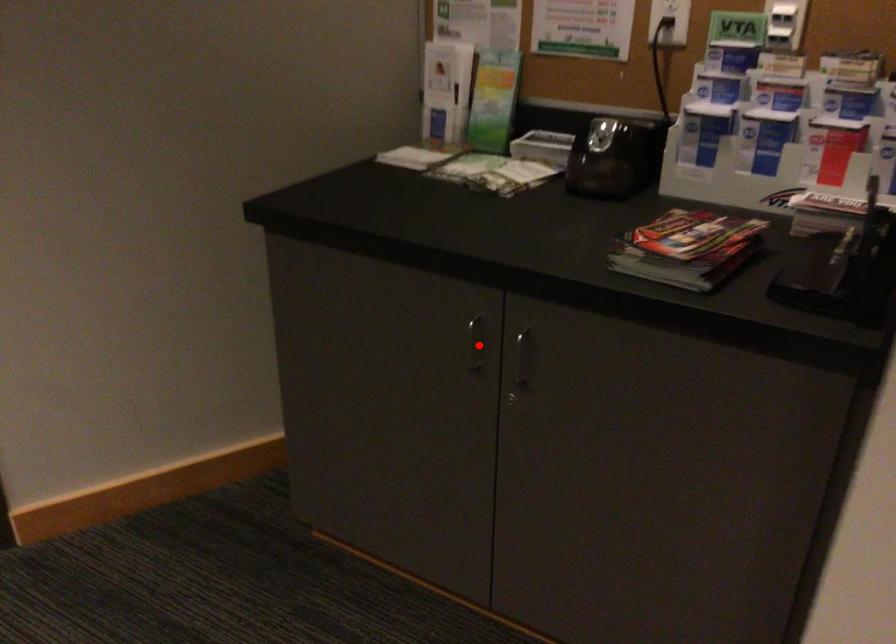
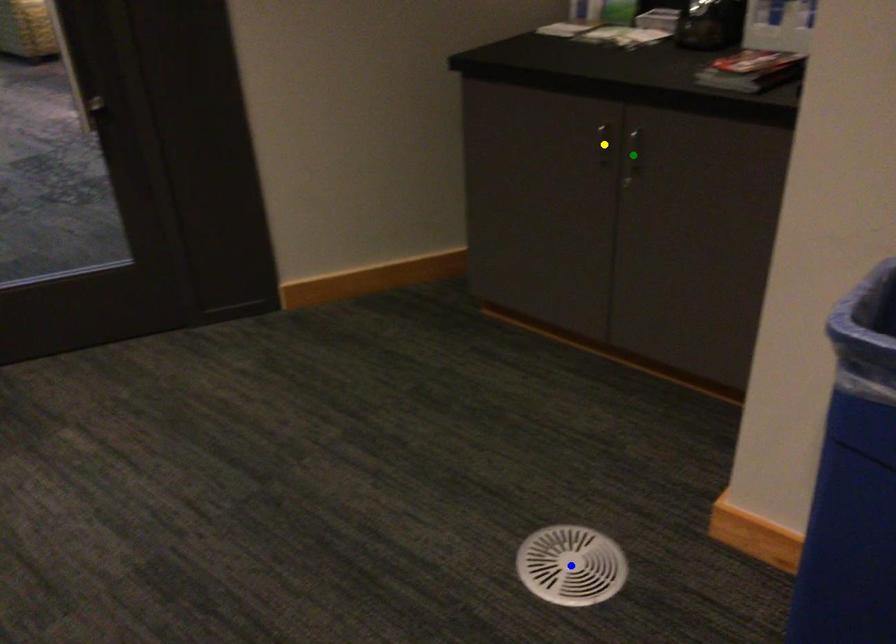
Question: I am providing you with two images of the same scene from different viewpoints. A red point is marked on the first image. You are given multiple points on the second image. Which spot in image 2 lines up with the point in image 1?

Choices:
 (A) blue point
 (B) green point
 (C) yellow point

Answer: (C)